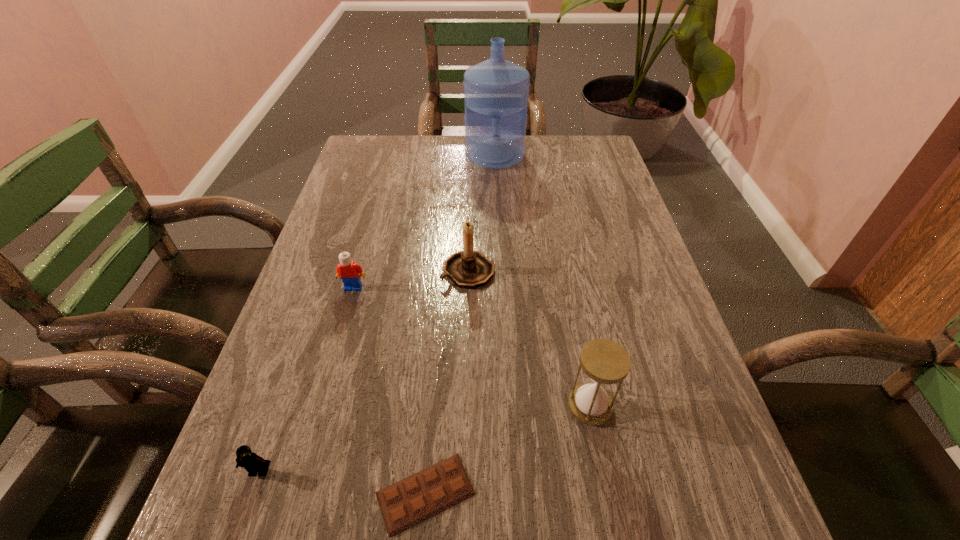
Find the location of a particular element. the tallest object is located at coordinates (496, 91).

This screenshot has width=960, height=540. In order to click on the farthest object in this screenshot , I will do `click(496, 91)`.

Locate an element on the screen. Image resolution: width=960 pixels, height=540 pixels. candle holder is located at coordinates (470, 269).

The width and height of the screenshot is (960, 540). I want to click on hourglass, so click(604, 361).

The height and width of the screenshot is (540, 960). I want to click on the rightmost object, so click(x=604, y=361).

You are a GUI agent. You are given a task and a screenshot of the screen. Output one action in this format:
    pyautogui.click(x=<x>, y=<y>)
    Task: Click on the taller Lego
    The width and height of the screenshot is (960, 540).
    Given the screenshot: What is the action you would take?
    pyautogui.click(x=350, y=273)

Locate an element on the screen. The image size is (960, 540). the right Lego is located at coordinates (350, 273).

Locate an element on the screen. This screenshot has height=540, width=960. the shorter Lego is located at coordinates (254, 464).

In order to click on the nearer Lego in this screenshot , I will do `click(254, 464)`.

Identify the location of the shortest object. tap(413, 499).